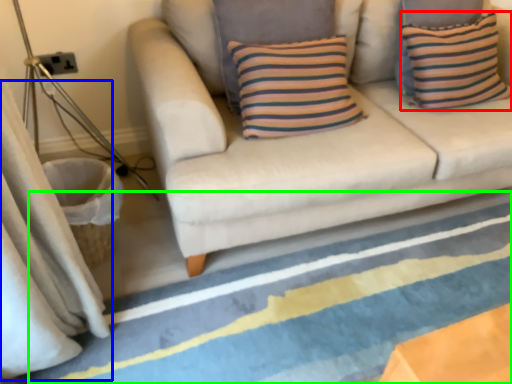
Question: Considering the real-world distances, which object is closest to pillow (highlighted by a red box)? curtain (highlighted by a blue box) or strip (highlighted by a green box).

Choices:
 (A) curtain
 (B) strip

Answer: (B)